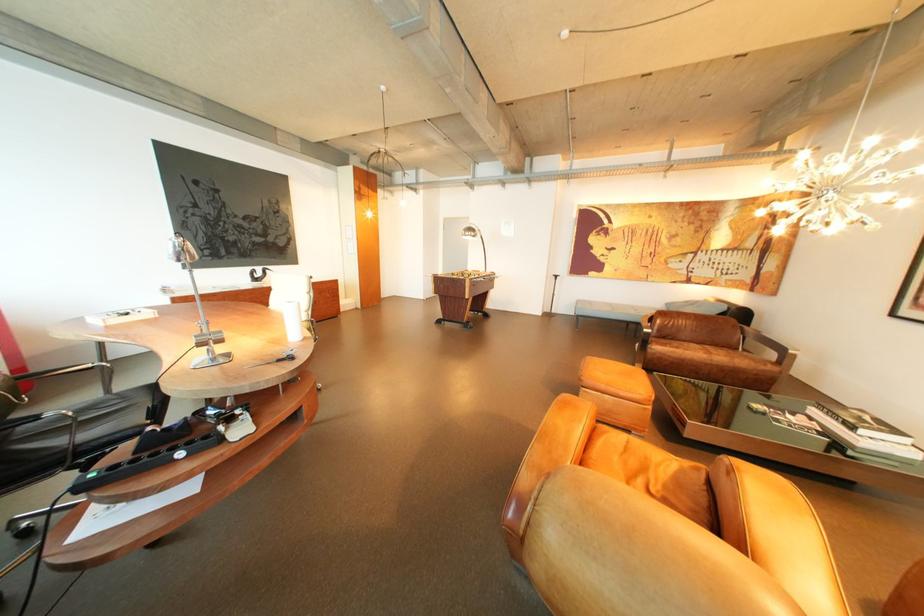
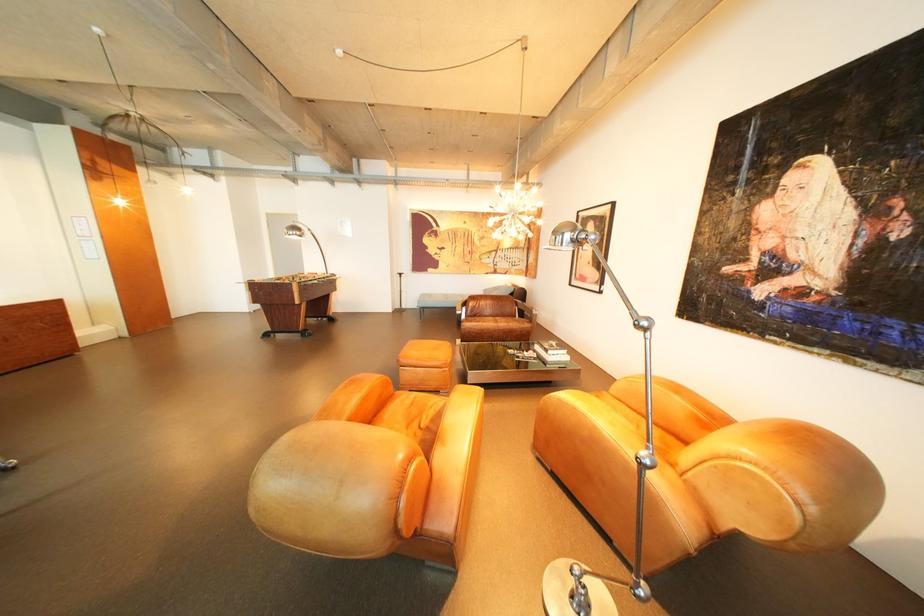
Question: Based on the continuous images, in which direction is the camera rotating? Reply with the corresponding letter.

Choices:
 (A) Left
 (B) Right
 (C) Up
 (D) Down

Answer: (B)